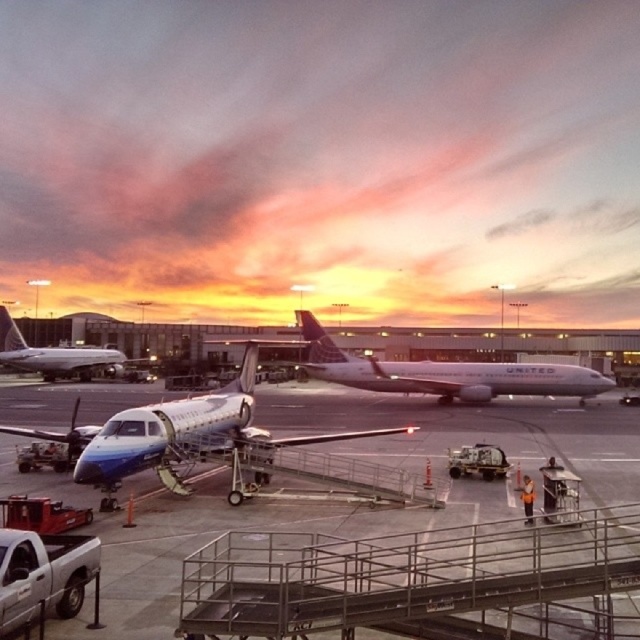
Measure the distance between point (108, 550) and camera.

A distance of 11.20 meters exists between point (108, 550) and camera.

Which is behind, point (468, 483) or point (300, 310)?

Positioned behind is point (300, 310).

Is point (476, 477) positioned before point (400, 380)?

Yes, point (476, 477) is closer to viewer.

This screenshot has width=640, height=640. Identify the location of metallic blue airplane at center-left. (364, 502).

Between point (65, 499) and point (77, 362), which one is positioned in front?

Point (65, 499) is in front.

From the picture: Is metallic blue airplane at center-left below white glossy airplane at center?

Correct, metallic blue airplane at center-left is located below white glossy airplane at center.

Locate an element on the screen. Image resolution: width=640 pixels, height=640 pixels. metallic blue airplane at center-left is located at coordinates (364, 502).

Does metallic blue airplane at center appear under white glossy airliner at center?

Yes, metallic blue airplane at center is below white glossy airliner at center.

Which of these two, metallic blue airplane at center or white glossy airliner at center, stands taller?

white glossy airliner at center

The image size is (640, 640). Identify the location of metallic blue airplane at center. (186, 433).